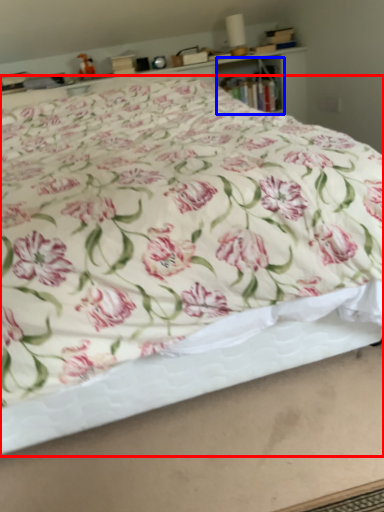
Question: Which object is closer to the camera taking this photo, bed (highlighted by a red box) or cabinet (highlighted by a blue box)?

Choices:
 (A) bed
 (B) cabinet

Answer: (A)